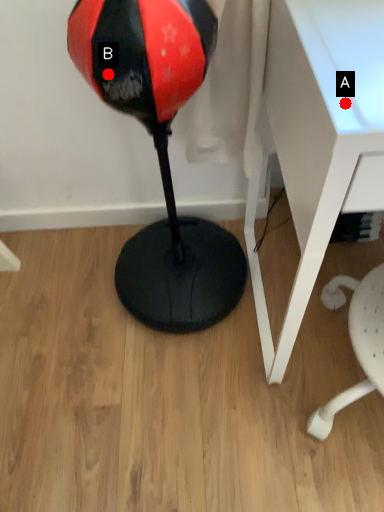
Question: Two points are circled on the image, labeled by A and B beside each circle. Which point is farther to the camera?

Choices:
 (A) A is further
 (B) B is further

Answer: (B)